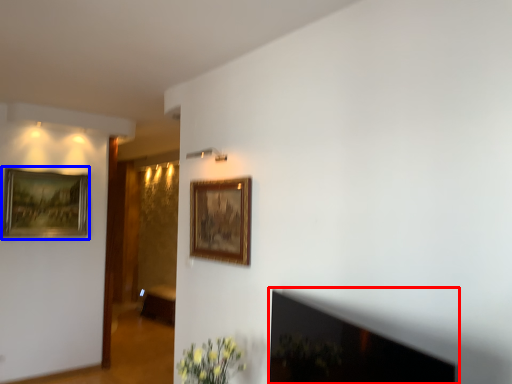
Question: Which object is further to the camera taking this photo, fireplace (highlighted by a red box) or picture frame (highlighted by a blue box)?

Choices:
 (A) fireplace
 (B) picture frame

Answer: (B)